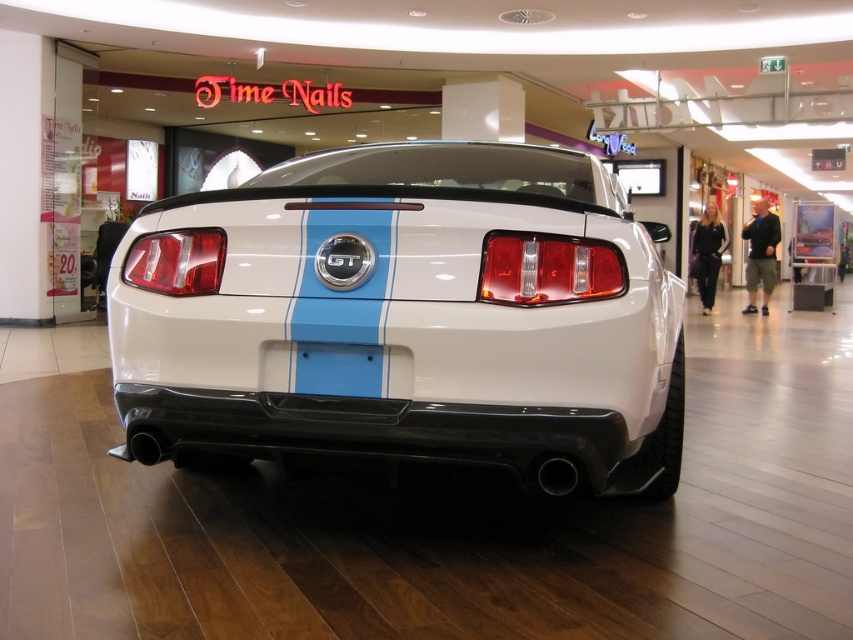
Between translucent red tail light at center and matte red tail light at center, which one is positioned higher?

matte red tail light at center

Between point (602, 260) and point (169, 237), which one is positioned behind?

The point (169, 237) is more distant.

The image size is (853, 640). I want to click on translucent red tail light at center, so click(548, 269).

Is white glossy car at center wider than translucent red tail light at center?

Yes, white glossy car at center is wider than translucent red tail light at center.

Does white glossy car at center come in front of translucent red tail light at center?

Yes, it is.

Is point (305, 355) positioned before point (556, 298)?

No.

This screenshot has height=640, width=853. Identify the location of white glossy car at center. (415, 321).

Does point (526, 432) come behind point (202, 269)?

No, (526, 432) is in front of (202, 269).

What do you see at coordinates (415, 321) in the screenshot?
I see `white glossy car at center` at bounding box center [415, 321].

Where is `white glossy car at center`? The width and height of the screenshot is (853, 640). white glossy car at center is located at coordinates (415, 321).